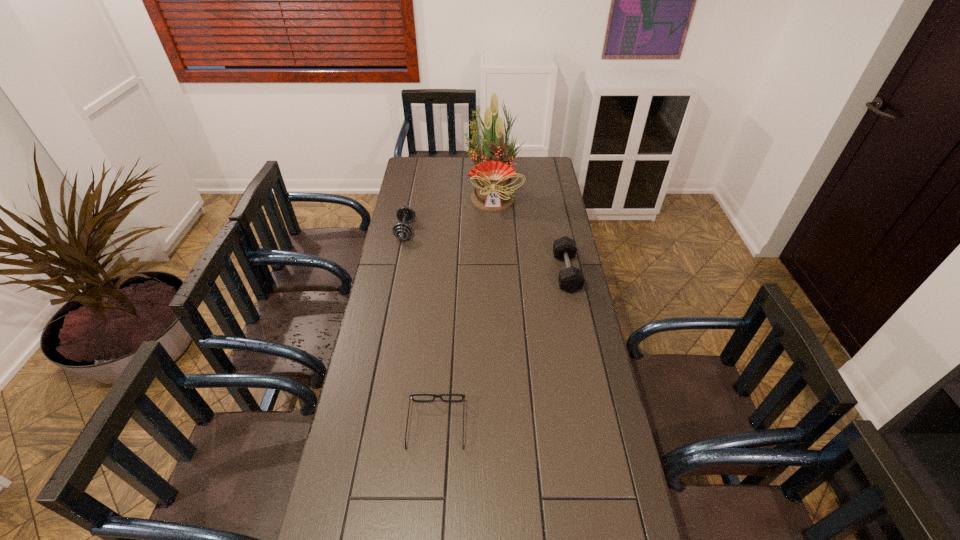
In the image, there is a desktop. Identify the location of vacant space at the far right corner. (550, 172).

Find the location of a particular element. The width and height of the screenshot is (960, 540). free space between the right dumbbell and the shorter dumbbell is located at coordinates (486, 252).

Locate an element on the screen. Image resolution: width=960 pixels, height=540 pixels. vacant area between the nearest object and the third nearest object is located at coordinates (420, 328).

Where is `unoccupied area between the farther dumbbell and the third farthest object`? unoccupied area between the farther dumbbell and the third farthest object is located at coordinates (486, 252).

At what (x,y) coordinates should I click in order to perform the action: click on free space between the right dumbbell and the flower arrangement. Please return your answer as a coordinate pair (x, y). Image resolution: width=960 pixels, height=540 pixels. Looking at the image, I should click on (530, 234).

You are a GUI agent. You are given a task and a screenshot of the screen. Output one action in this format:
    pyautogui.click(x=<x>, y=<y>)
    Task: Click on the blank region between the shortest object and the third nearest object
    The image size is (960, 540).
    Given the screenshot: What is the action you would take?
    pyautogui.click(x=420, y=328)

Where is `vacant space in between the rightmost object and the spectacles`? The image size is (960, 540). vacant space in between the rightmost object and the spectacles is located at coordinates pyautogui.click(x=501, y=349).

This screenshot has height=540, width=960. I want to click on vacant space that is in between the leftmost object and the shortest object, so tap(420, 328).

Image resolution: width=960 pixels, height=540 pixels. What are the coordinates of `vacant area between the flower arrangement and the right dumbbell` in the screenshot? It's located at (530, 234).

Where is `empty location between the rightmost object and the leftmost object`? The image size is (960, 540). empty location between the rightmost object and the leftmost object is located at coordinates (486, 252).